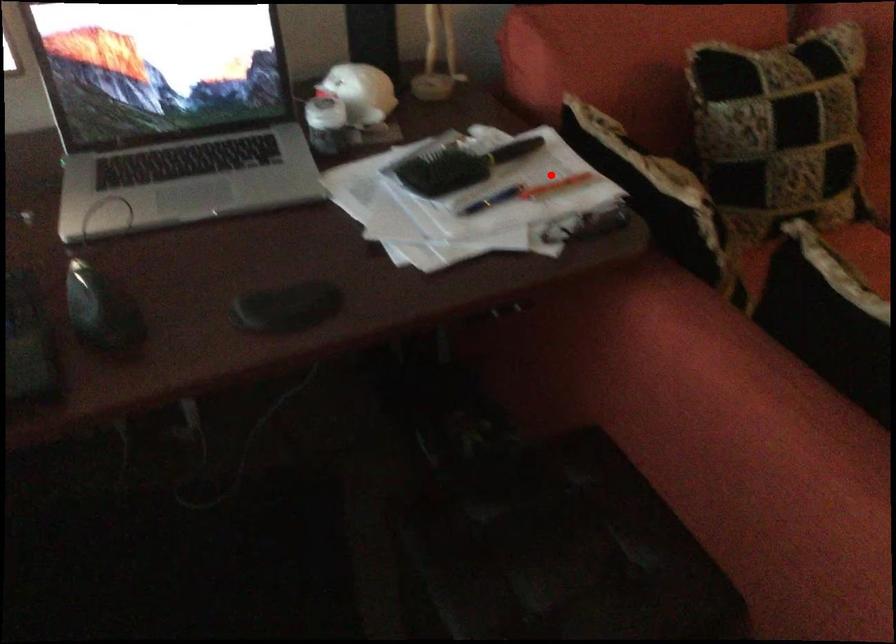
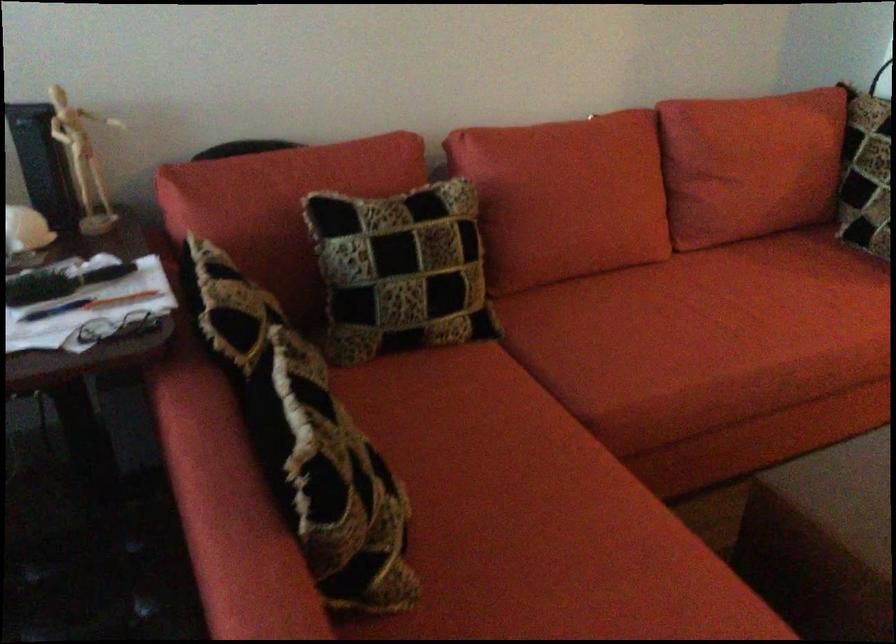
Question: I am providing you with two images of the same scene from different viewpoints. A red point is shown in image1. For the corresponding object point in image2, is it positioned nearer or farther from the camera?

Choices:
 (A) Nearer
 (B) Farther

Answer: (B)